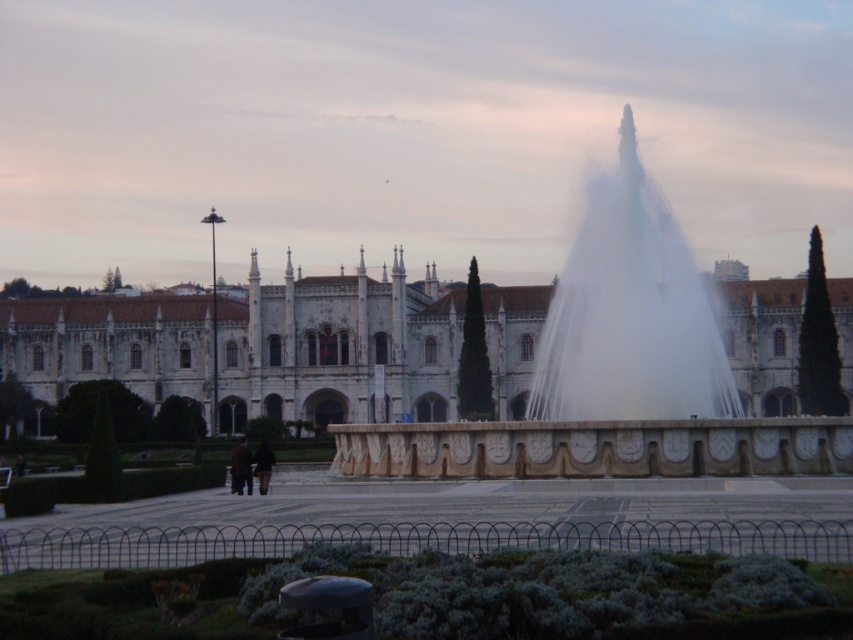
Which of these two, white stone building at center or white stone fountain at center, stands taller?

white stone fountain at center is taller.

Which is more to the right, white stone building at center or white stone fountain at center?

white stone fountain at center is more to the right.

This screenshot has width=853, height=640. Find the location of `white stone building at center`. white stone building at center is located at coordinates (335, 348).